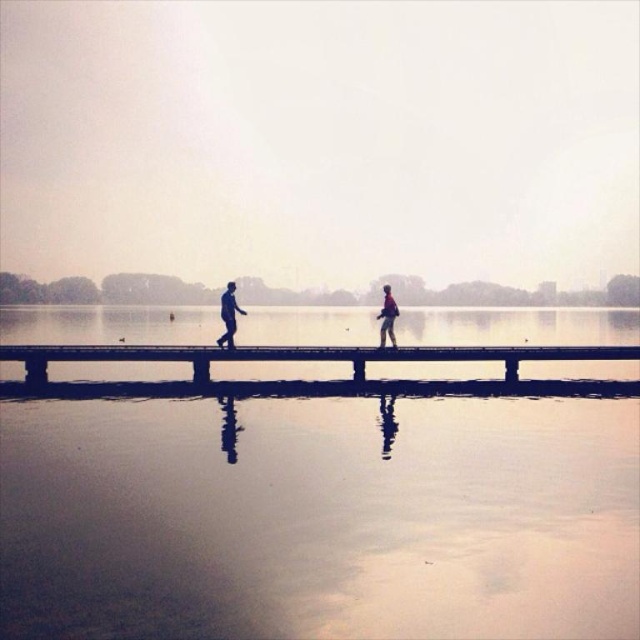
Which is below, matte black figure at center or matte gray jacket at center?

Positioned lower is matte gray jacket at center.

Does matte black figure at center have a greater width compared to matte gray jacket at center?

Correct, the width of matte black figure at center exceeds that of matte gray jacket at center.

Find the location of a particular element. The height and width of the screenshot is (640, 640). matte black figure at center is located at coordinates (228, 316).

Can you confirm if smooth wooden dock at center is bigger than matte black figure at center?

Yes, smooth wooden dock at center is bigger than matte black figure at center.

Locate an element on the screen. smooth wooden dock at center is located at coordinates (301, 355).

Image resolution: width=640 pixels, height=640 pixels. In order to click on smooth wooden dock at center in this screenshot , I will do `click(301, 355)`.

Which is more to the right, smooth wooden dock at center or matte gray jacket at center?

matte gray jacket at center

Is point (368, 348) positioned behind point (388, 294)?

No, it is in front of (388, 294).

Find the location of a particular element. This screenshot has width=640, height=640. smooth wooden dock at center is located at coordinates (301, 355).